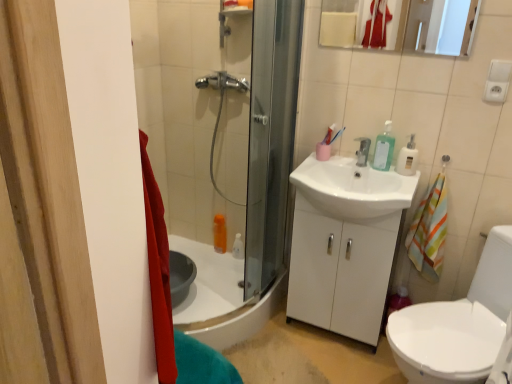
Question: In the image, is clear plastic soap dispenser at upper right positioned in front of or behind matte white mirror at upper center?

Choices:
 (A) behind
 (B) front

Answer: (A)

Question: From the image's perspective, is clear plastic soap dispenser at upper right above or below matte white mirror at upper center?

Choices:
 (A) above
 (B) below

Answer: (B)

Question: Estimate the real-world distances between objects in this image. Which object is farther from the clear plastic soap dispenser at upper right?

Choices:
 (A) silver metallic faucet at center
 (B) white glossy sink at center
 (C) translucent plastic soap dispenser at upper right
 (D) matte white mirror at upper center

Answer: (D)

Question: Estimate the real-world distances between objects in this image. Which object is closer to the silver metallic faucet at center?

Choices:
 (A) clear plastic soap dispenser at upper right
 (B) white glossy sink at center
 (C) matte white mirror at upper center
 (D) translucent plastic soap dispenser at upper right

Answer: (D)